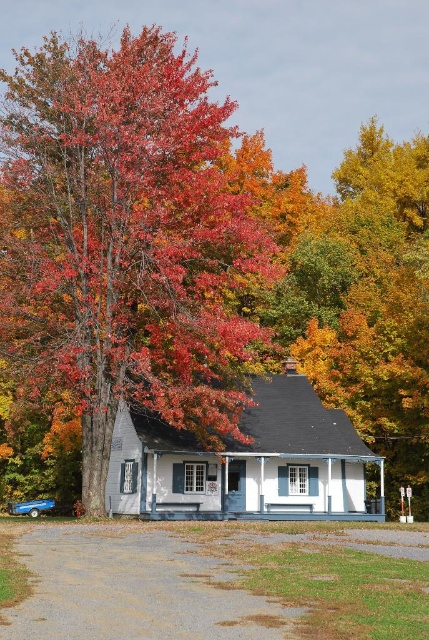
You are a gardener planning to place a 10 meter long decorative fence between the shiny red leaves at left and the gray gravel driveway at lower center. Can you fit the fence between them without it overlapping either object?

The distance between the shiny red leaves at left and the gray gravel driveway at lower center is 15.22 meters. Since the fence is only 10 meters long, there is enough space to place it between them without overlapping either object.

You are standing in front of the house and notice the shiny red leaves at left and the gray gravel driveway at lower center. Which object is taller?

The shiny red leaves at left are taller than the gray gravel driveway at lower center.

You are standing in front of the house and want to walk from the shiny red leaves at left to the gray gravel driveway at lower center. Which direction should you move to get closer to the driveway?

You should move away from the viewer since the shiny red leaves at left is closer to you than the gray gravel driveway at lower center, meaning the driveway is further back. To reach it, you need to move forward away from your current position near the leaves.